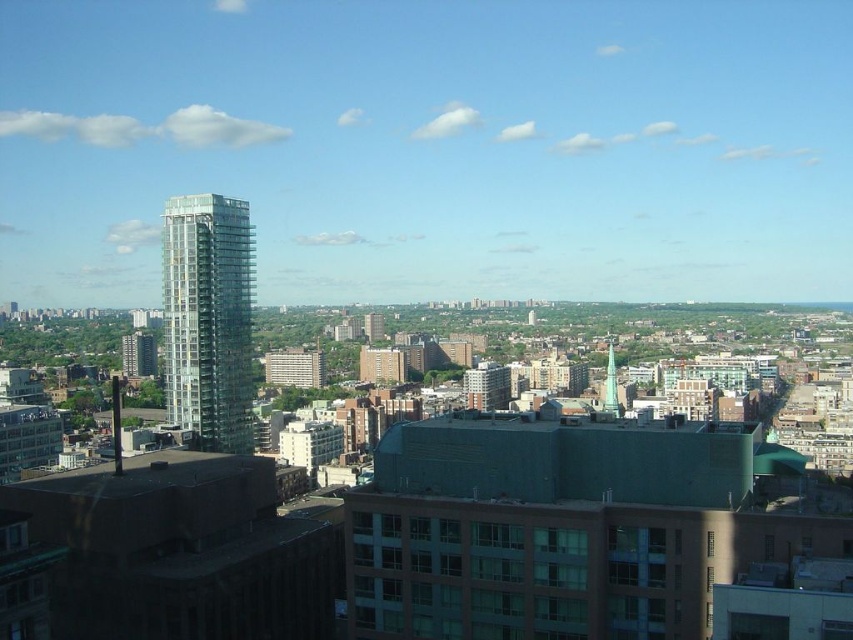
Question: Does transparent glass tower at left appear on the right side of green glass tower at center?

Choices:
 (A) no
 (B) yes

Answer: (A)

Question: In this image, where is transparent glass tower at left located relative to green glass tower at center?

Choices:
 (A) right
 (B) left

Answer: (B)

Question: Does transparent glass tower at left come in front of green glass tower at center?

Choices:
 (A) yes
 (B) no

Answer: (A)

Question: Which object appears farthest from the camera in this image?

Choices:
 (A) transparent glass tower at left
 (B) green glass tower at center

Answer: (B)

Question: Which object is closer to the camera taking this photo?

Choices:
 (A) transparent glass tower at left
 (B) green glass tower at center

Answer: (A)